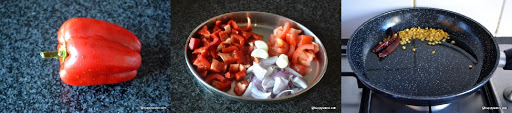
The height and width of the screenshot is (113, 512). I want to click on handle, so click(507, 63).